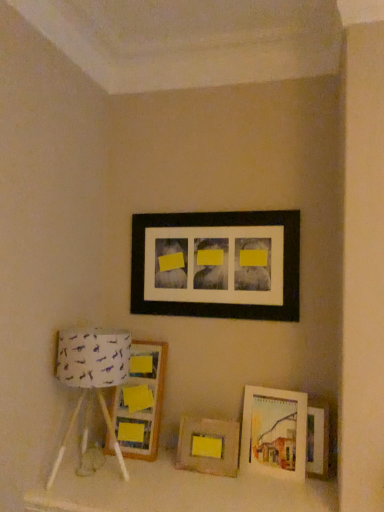
What are the coordinates of `empty space that is ontop of black matte picture frame at upper center, arranged as the fifth picture frame when ordered from the bottom (from a real-world perspective)` in the screenshot? It's located at (209, 206).